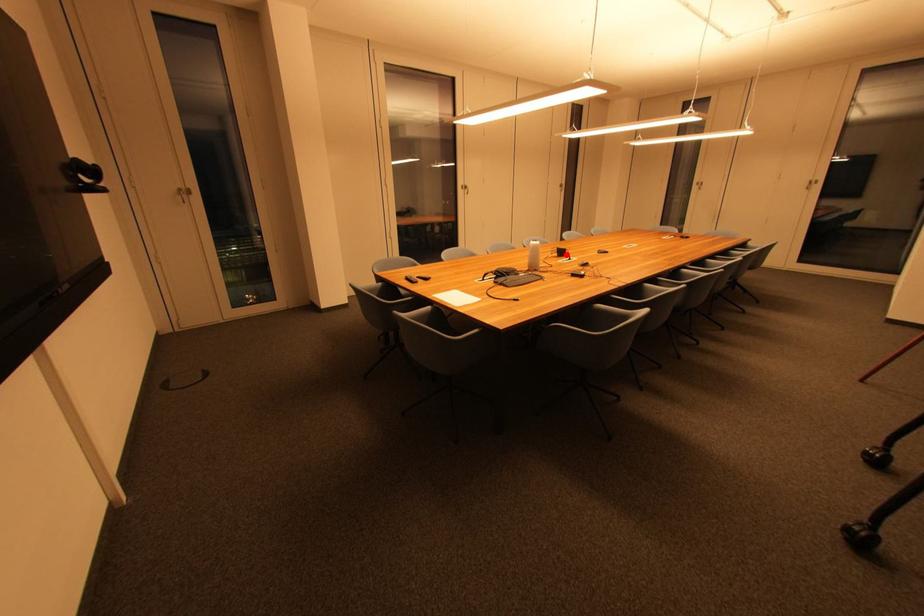
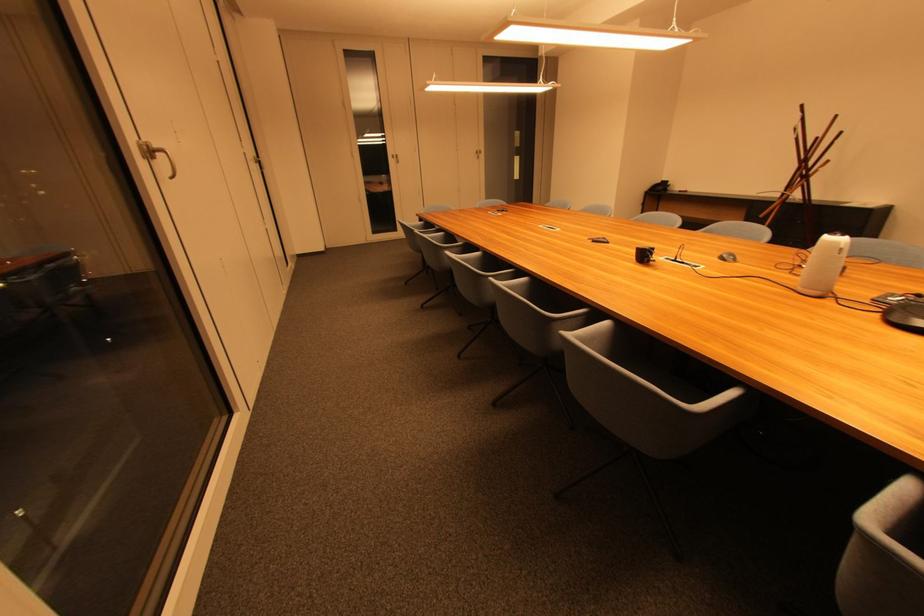
Where in the second image is the point corresponding to the highlighted location from the first image?

(649, 257)